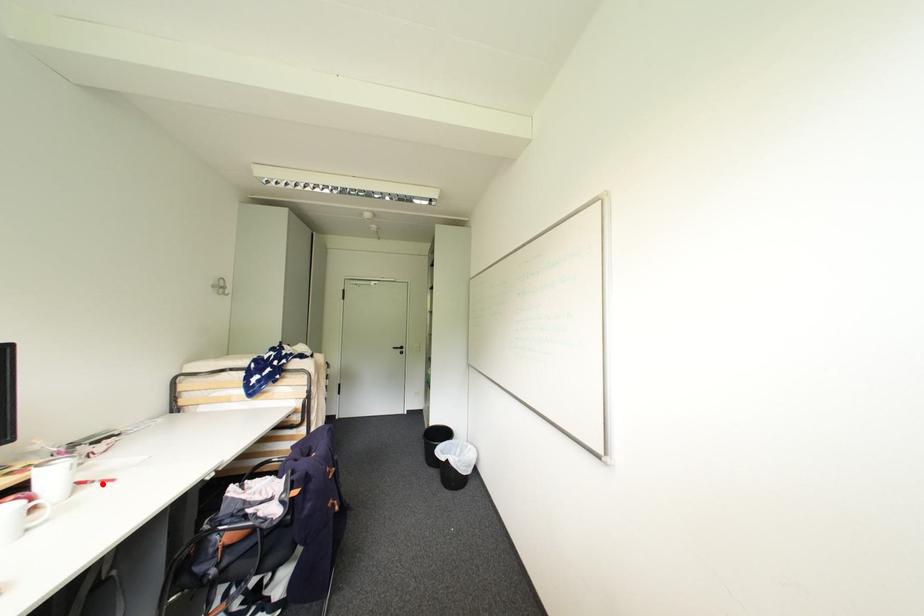
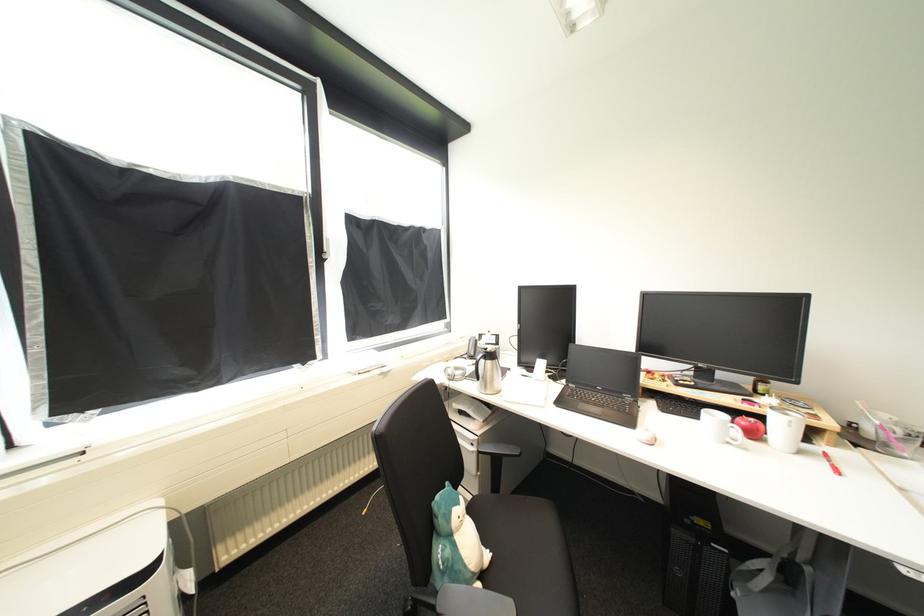
In the second image, find the point that corresponds to the highlighted location in the first image.

(834, 464)